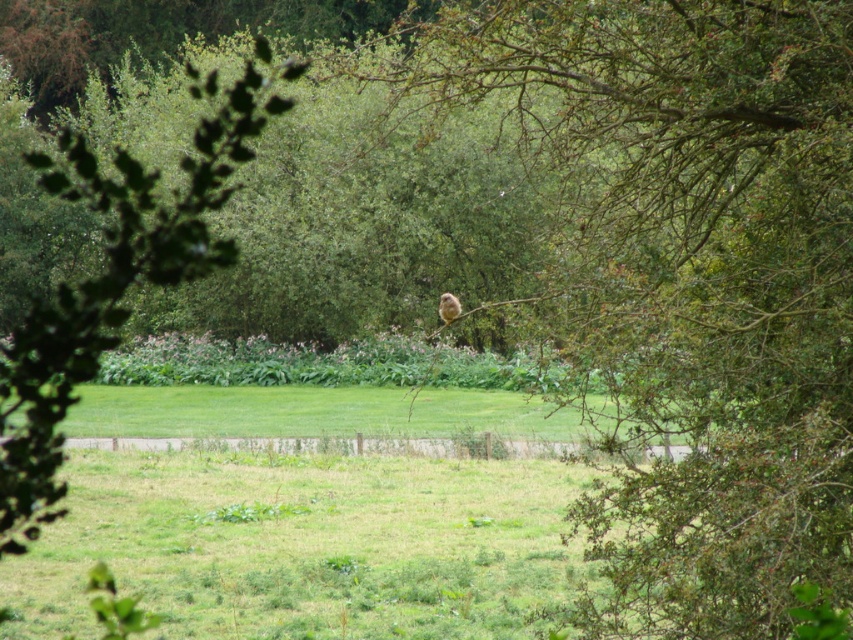
Between brown textured branch at center and green leafy tree at upper left, which one has less height?

green leafy tree at upper left

Can you confirm if brown textured branch at center is smaller than green leafy tree at upper left?

Yes.

Which is behind, point (675, 257) or point (103, 348)?

The point (103, 348) is more distant.

Where is `brown textured branch at center`? The height and width of the screenshot is (640, 853). brown textured branch at center is located at coordinates (688, 282).

Between point (160, 241) and point (447, 292), which one is positioned behind?

Point (447, 292)

This screenshot has width=853, height=640. In order to click on green leafy tree at upper left in this screenshot , I will do `click(113, 284)`.

Is brown textured branch at center to the left of fuzzy brown bird at center from the viewer's perspective?

No, brown textured branch at center is not to the left of fuzzy brown bird at center.

Is brown textured branch at center thinner than fuzzy brown bird at center?

Incorrect, brown textured branch at center's width is not less than fuzzy brown bird at center's.

Identify the location of brown textured branch at center. (688, 282).